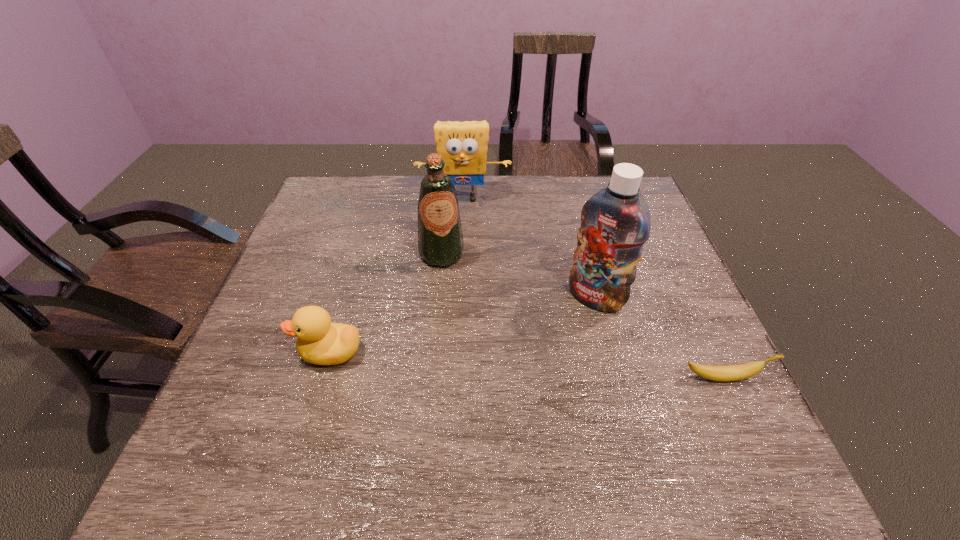
This screenshot has width=960, height=540. What are the coordinates of `vacant point located between the fourth object from left to right and the leftmost object` in the screenshot? It's located at (463, 325).

Find the location of a particular element. Image resolution: width=960 pixels, height=540 pixels. unoccupied area between the third farthest object and the fourth shortest object is located at coordinates (518, 276).

Where is `empty space between the tallest object and the banana`? This screenshot has width=960, height=540. empty space between the tallest object and the banana is located at coordinates (660, 338).

The image size is (960, 540). What are the coordinates of `free area in between the nearest object and the fourth nearest object` in the screenshot? It's located at (583, 316).

Identify the location of the third closest object to the sponge. The image size is (960, 540). (321, 342).

Where is `object that is the second closest to the fourth tallest object`? The width and height of the screenshot is (960, 540). object that is the second closest to the fourth tallest object is located at coordinates (615, 222).

Locate an element on the screen. The image size is (960, 540). vacant space that satisfies the following two spatial constraints: 1. on the front side of the fourth nearest object; 2. on the right side of the third nearest object is located at coordinates (438, 298).

I want to click on free space that satisfies the following two spatial constraints: 1. on the front side of the rightmost object; 2. at the stem of the sponge, so click(x=455, y=378).

Image resolution: width=960 pixels, height=540 pixels. Identify the location of vacant space that satisfies the following two spatial constraints: 1. on the front side of the shortest object; 2. at the stem of the fourth object from left to right. (616, 378).

This screenshot has width=960, height=540. What are the coordinates of `free space that satisfies the following two spatial constraints: 1. on the front side of the shampoo; 2. on the right side of the farthest object` in the screenshot? It's located at (459, 298).